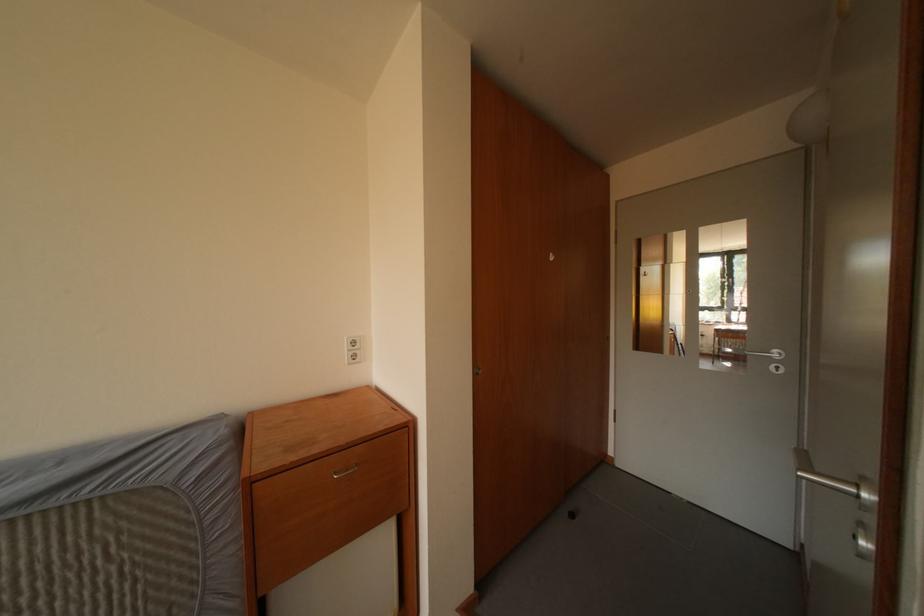
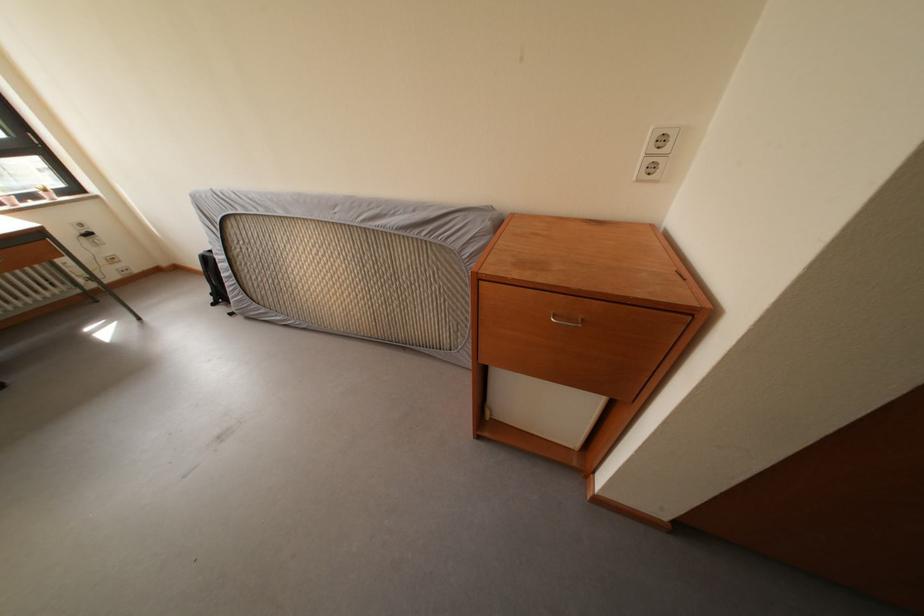
Where in the second image is the point corresponding to point 362,349 from the first image?

(671, 147)